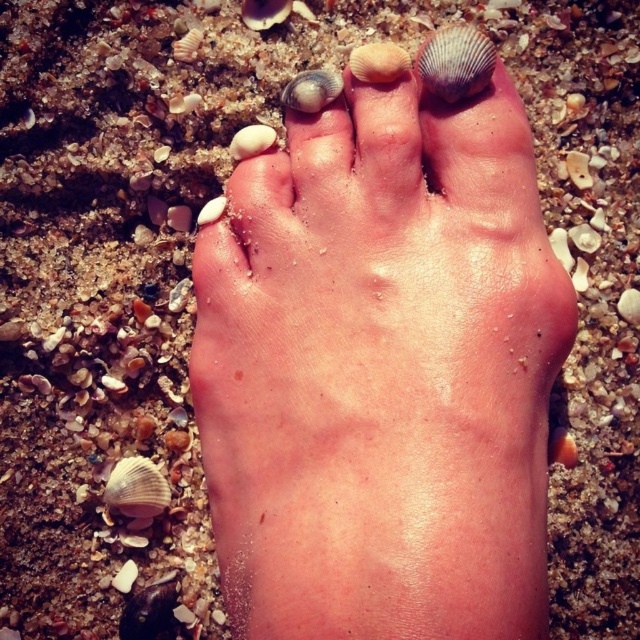
Is shiny brown seashell at upper right wider than shiny metallic seashell at center?

Correct, the width of shiny brown seashell at upper right exceeds that of shiny metallic seashell at center.

Does shiny brown seashell at upper right have a smaller size compared to shiny metallic seashell at center?

Incorrect, shiny brown seashell at upper right is not smaller in size than shiny metallic seashell at center.

Which is behind, point (449, 45) or point (310, 83)?

Point (310, 83)

This screenshot has height=640, width=640. I want to click on shiny brown seashell at upper right, so click(456, 64).

Is dry skin foot at center to the left of shiny metallic seashell at center from the viewer's perspective?

Incorrect, dry skin foot at center is not on the left side of shiny metallic seashell at center.

Between point (355, 173) and point (305, 88), which one is positioned behind?

The point (305, 88) is more distant.

This screenshot has height=640, width=640. What are the coordinates of `dry skin foot at center` in the screenshot? It's located at (381, 372).

Which is more to the right, dry skin foot at center or shiny brown seashell at upper right?

Positioned to the right is shiny brown seashell at upper right.

Who is more distant from viewer, (x=230, y=371) or (x=467, y=65)?

Positioned behind is point (x=467, y=65).

Describe the element at coordinates (381, 372) in the screenshot. I see `dry skin foot at center` at that location.

Image resolution: width=640 pixels, height=640 pixels. In order to click on dry skin foot at center in this screenshot , I will do pyautogui.click(x=381, y=372).